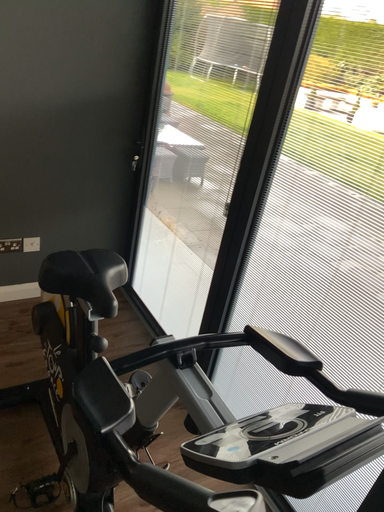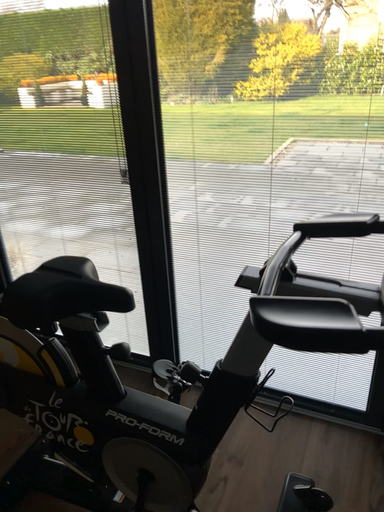
Question: How did the camera likely rotate when shooting the video?

Choices:
 (A) rotated right
 (B) rotated left

Answer: (A)